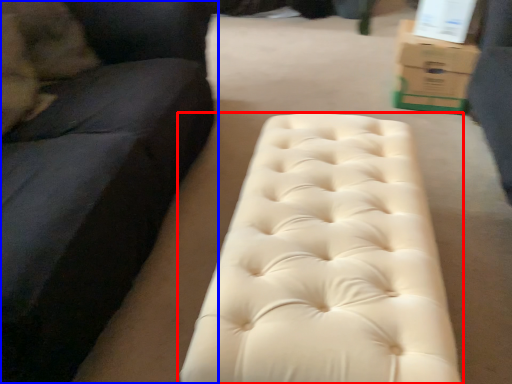
Question: Which point is closer to the camera, furniture (highlighted by a red box) or studio couch (highlighted by a blue box)?

Choices:
 (A) furniture
 (B) studio couch

Answer: (B)